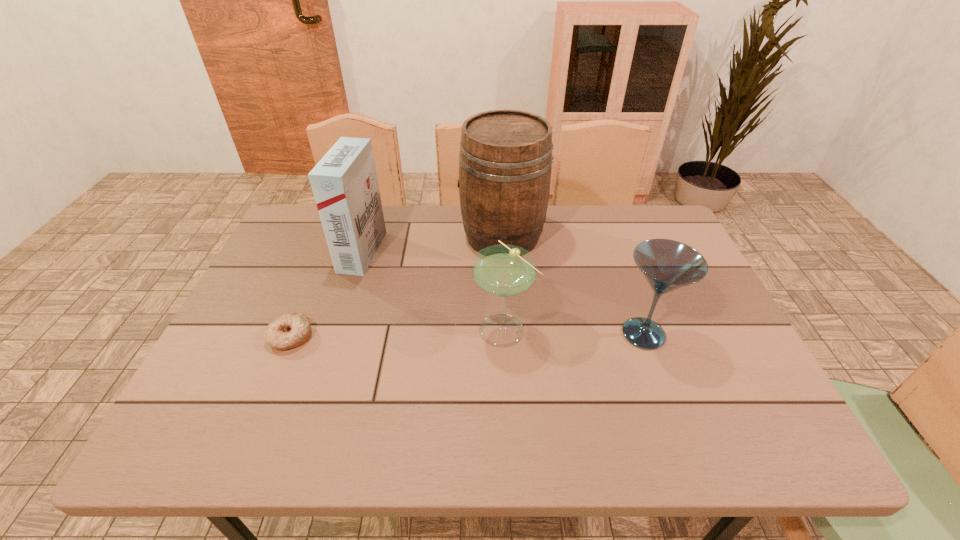
Where is `cider`? The image size is (960, 540). cider is located at coordinates (505, 161).

Where is `cigarette case`? This screenshot has height=540, width=960. cigarette case is located at coordinates (344, 182).

Where is `the rightmost object`? This screenshot has height=540, width=960. the rightmost object is located at coordinates (667, 265).

You are a GUI agent. You are given a task and a screenshot of the screen. Output one action in this format:
    pyautogui.click(x=<x>, y=<y>)
    Task: Click on the left martini
    This screenshot has width=960, height=540.
    Given the screenshot: What is the action you would take?
    pyautogui.click(x=503, y=270)

This screenshot has width=960, height=540. In order to click on doughnut in this screenshot , I will do `click(290, 330)`.

I want to click on vacant area situated 0.220m on the side of the cider near the bung hole, so click(x=387, y=237).

Locate an element on the screen. This screenshot has width=960, height=540. free space located 0.270m on the side of the cider near the bung hole is located at coordinates (371, 237).

Where is `free space located on the side of the cider near the bung hole`? Image resolution: width=960 pixels, height=540 pixels. free space located on the side of the cider near the bung hole is located at coordinates point(414,237).

At what (x,y) coordinates should I click in order to perform the action: click on vacant area situated on the right of the cigarette case. Please return your answer as a coordinate pair (x, y). The image size is (960, 540). Looking at the image, I should click on (437, 252).

The width and height of the screenshot is (960, 540). I want to click on vacant space located on the back of the right martini, so click(x=623, y=277).